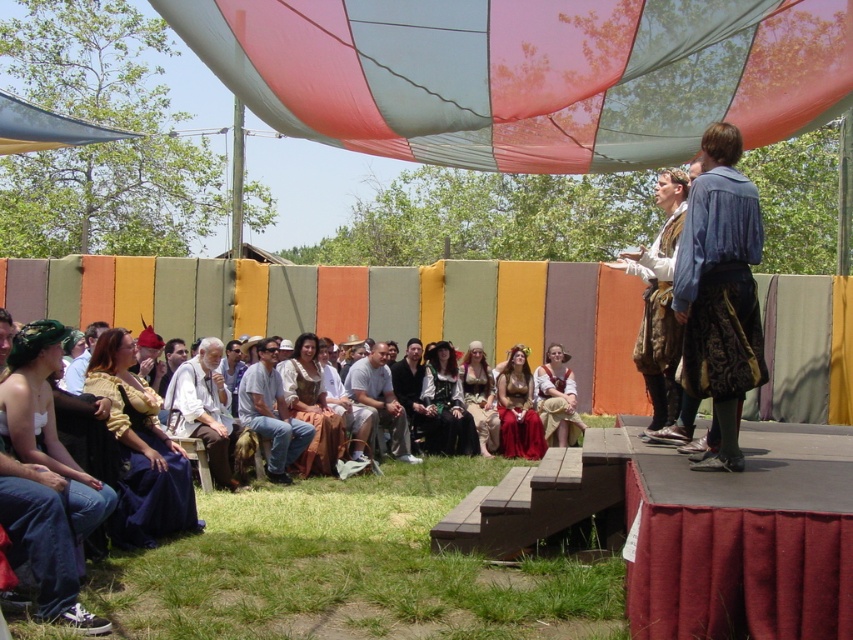
Question: Observing the image, what is the correct spatial positioning of multicolored fabric canopy at upper center in reference to matte yellow dress at lower left?

Choices:
 (A) below
 (B) above

Answer: (B)

Question: Does matte red dress at center have a larger size compared to matte brown leather skirt at center?

Choices:
 (A) yes
 (B) no

Answer: (B)

Question: Which object is positioned closest to the matte brown dress at center?

Choices:
 (A) light brown leather pants at center
 (B) matte yellow dress at lower left
 (C) matte brown leather jacket at lower left

Answer: (A)

Question: Which object is positioned farthest from the matte brown leather jacket at lower left?

Choices:
 (A) matte brown leather skirt at center
 (B) white linen shirt at center
 (C) matte brown leather purse at center
 (D) blue denim shirt at upper right

Answer: (D)

Question: In this image, where is denim jeans at center located relative to matte brown leather purse at center?

Choices:
 (A) below
 (B) above

Answer: (B)

Question: Which of the following is the closest to the observer?

Choices:
 (A) (374, 404)
 (B) (148, 340)
 (C) (183, 342)

Answer: (B)